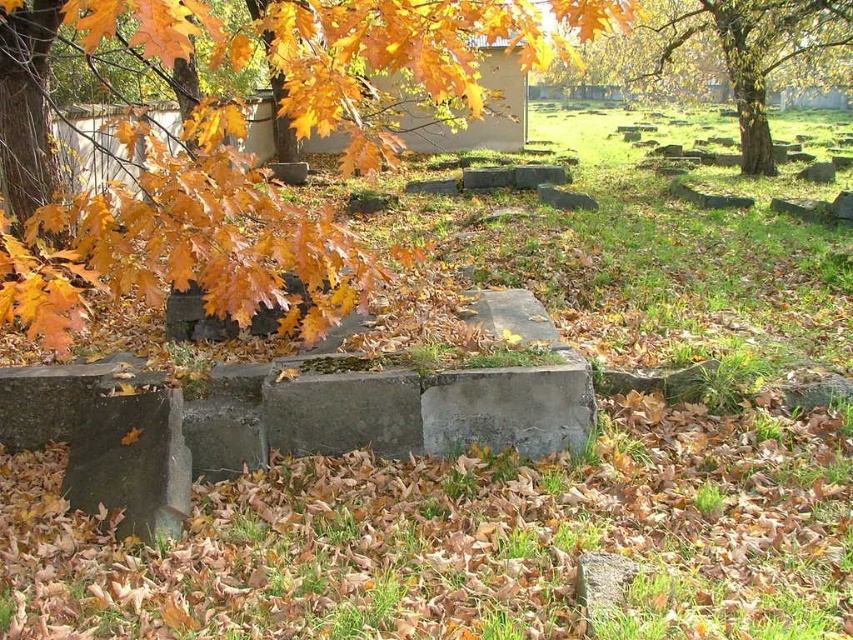
You are standing in the cemetery and notice the golden leaves at upper left. Based on their position, can you determine if they are closer to you or further away compared to the gravestones in the foreground?

The golden leaves at upper left are located at point (187,241), which places them in the upper left corner of the image. Since the gravestones are in the foreground, the leaves are further away from you compared to the gravestones.

You are standing in the autumn cemetery and notice two elements in the scene. One is the golden leaves at upper left and the other is the golden oak tree at upper right. Based on their positions, which one is closer to the ground?

The golden leaves at upper left are closer to the ground because they are located below the golden oak tree at upper right.

You are a gardener trying to determine if the golden leaves at upper left are within a 10 meter radius of the golden oak tree at upper right. Based on the scene, can you confirm if they are within this distance?

The distance between the golden leaves at upper left and the golden oak tree at upper right is 9.58 meters, which is within the 10 meter radius. Therefore, they are within the specified distance.